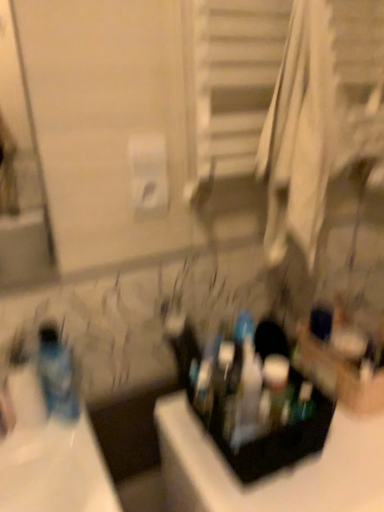
What do you see at coordinates (303, 403) in the screenshot?
I see `translucent plastic mouthwash at center` at bounding box center [303, 403].

This screenshot has height=512, width=384. What do you see at coordinates (57, 374) in the screenshot? I see `translucent plastic bottle at left` at bounding box center [57, 374].

This screenshot has height=512, width=384. Describe the element at coordinates (148, 172) in the screenshot. I see `white matte toilet paper at upper center` at that location.

What is the approximate height of translucent plastic toothbrush at center?

2.91 inches.

What do you see at coordinates (204, 387) in the screenshot? The image size is (384, 512). I see `translucent plastic toothbrush at center` at bounding box center [204, 387].

The width and height of the screenshot is (384, 512). What are the coordinates of `translucent plastic mouthwash at center` in the screenshot? It's located at (303, 403).

From a real-world perspective, between white matte toilet paper at upper center and translucent plastic toothbrush at center, who is vertically higher?

white matte toilet paper at upper center is physically above.

Are white matte toilet paper at upper center and translucent plastic toothbrush at center making contact?

No, white matte toilet paper at upper center is not touching translucent plastic toothbrush at center.

Could you tell me if white matte toilet paper at upper center is facing translucent plastic toothbrush at center?

No.

Is white matte toilet paper at upper center thinner than translucent plastic toothbrush at center?

Yes.

Considering the sizes of objects white matte toilet paper at upper center and translucent plastic mouthwash at center in the image provided, who is smaller, white matte toilet paper at upper center or translucent plastic mouthwash at center?

With smaller size is translucent plastic mouthwash at center.

Is white matte toilet paper at upper center looking in the opposite direction of translucent plastic mouthwash at center?

No, white matte toilet paper at upper center's orientation is not away from translucent plastic mouthwash at center.

From a real-world perspective, which object stands above the other?

white matte toilet paper at upper center, from a real-world perspective.

Which is more to the right, black plastic container at center or translucent plastic toothbrush at center?

From the viewer's perspective, black plastic container at center appears more on the right side.

Considering their positions, is black plastic container at center located in front of or behind translucent plastic toothbrush at center?

black plastic container at center is positioned closer to the viewer than translucent plastic toothbrush at center.

Which of these two, black plastic container at center or translucent plastic toothbrush at center, stands taller?

With more height is black plastic container at center.

Measure the distance from black plastic container at center to translucent plastic toothbrush at center.

black plastic container at center is 6.80 inches away from translucent plastic toothbrush at center.

Which of these two, translucent plastic mouthwash at center or white matte toilet paper at upper center, is wider?

translucent plastic mouthwash at center.

Which is correct: translucent plastic mouthwash at center is inside white matte toilet paper at upper center, or outside of it?

translucent plastic mouthwash at center exists outside the volume of white matte toilet paper at upper center.

Which object is further away from the camera, translucent plastic mouthwash at center or white matte toilet paper at upper center?

white matte toilet paper at upper center is further from the camera.

From the image's perspective, which one is positioned lower, translucent plastic toothbrush at center or white matte toilet paper at upper center?

translucent plastic toothbrush at center, from the image's perspective.

I want to click on toilet paper above the translucent plastic toothbrush at center (from the image's perspective), so click(x=148, y=172).

Which is nearer, (201, 408) or (163, 208)?

Point (201, 408) is closer to the camera than point (163, 208).

Can you see translucent plastic mouthwash at center touching translucent plastic toothbrush at center?

No, translucent plastic mouthwash at center is not with translucent plastic toothbrush at center.

From a real-world perspective, is translucent plastic mouthwash at center physically located above or below translucent plastic toothbrush at center?

From a real-world perspective, translucent plastic mouthwash at center is physically below translucent plastic toothbrush at center.

What's the angular difference between translucent plastic mouthwash at center and translucent plastic toothbrush at center's facing directions?

The facing directions of translucent plastic mouthwash at center and translucent plastic toothbrush at center are 0.00701 degrees apart.

Measure the distance from translucent plastic mouthwash at center to translucent plastic toothbrush at center.

translucent plastic mouthwash at center and translucent plastic toothbrush at center are 7.10 inches apart.

Is white matte toilet paper at upper center taller than black plastic container at center?

Incorrect, the height of white matte toilet paper at upper center is not larger of that of black plastic container at center.

From the image's perspective, is white matte toilet paper at upper center located above black plastic container at center?

Yes.

How different are the orientations of white matte toilet paper at upper center and black plastic container at center in degrees?

0.672 degrees separate the facing orientations of white matte toilet paper at upper center and black plastic container at center.

Is white matte toilet paper at upper center looking in the opposite direction of black plastic container at center?

white matte toilet paper at upper center does not have its back to black plastic container at center.

The height and width of the screenshot is (512, 384). Identify the location of toiletry below the white matte toilet paper at upper center (from the image's perspective). (204, 387).

The image size is (384, 512). What are the coordinates of `toilet paper behind the translucent plastic mouthwash at center` in the screenshot? It's located at (148, 172).

Which object lies nearer to the anchor point translucent plastic bottle at left, white matte toilet paper at upper center or black plastic container at center?

The object closer to translucent plastic bottle at left is black plastic container at center.

From the image, which object appears to be nearer to translucent plastic bottle at left, translucent plastic mouthwash at center or white matte toilet paper at upper center?

white matte toilet paper at upper center lies closer to translucent plastic bottle at left than the other object.

Considering their positions, is translucent plastic mouthwash at center positioned closer to translucent plastic toothbrush at center than white matte toilet paper at upper center?

translucent plastic mouthwash at center is positioned closer to the anchor translucent plastic toothbrush at center.

Which object lies further to the anchor point translucent plastic bottle at left, translucent plastic toothbrush at center or white matte toilet paper at upper center?

Among the two, white matte toilet paper at upper center is located further to translucent plastic bottle at left.

When comparing their distances from black plastic container at center, does translucent plastic bottle at left or white matte toilet paper at upper center seem further?

white matte toilet paper at upper center is further to black plastic container at center.

Based on their spatial positions, is translucent plastic bottle at left or translucent plastic mouthwash at center closer to white matte toilet paper at upper center?

translucent plastic bottle at left is positioned closer to the anchor white matte toilet paper at upper center.

Consider the image. Estimate the real-world distances between objects in this image. Which object is closer to translucent plastic bottle at left, translucent plastic toothbrush at center or black plastic container at center?

translucent plastic toothbrush at center is positioned closer to the anchor translucent plastic bottle at left.

Looking at this image, based on their spatial positions, is translucent plastic bottle at left or translucent plastic toothbrush at center closer to white matte toilet paper at upper center?

translucent plastic bottle at left is closer to white matte toilet paper at upper center.

Find the location of a particular element. Image resolution: width=384 pixels, height=512 pixels. mouthwash that lies between white matte toilet paper at upper center and black plastic container at center from top to bottom is located at coordinates (303, 403).

Identify the location of toilet paper located between translucent plastic bottle at left and translucent plastic mouthwash at center in the left-right direction. (148, 172).

Locate an element on the screen. bottle that lies between white matte toilet paper at upper center and black plastic container at center from top to bottom is located at coordinates (57, 374).

I want to click on toiletry between translucent plastic bottle at left and black plastic container at center, so click(204, 387).